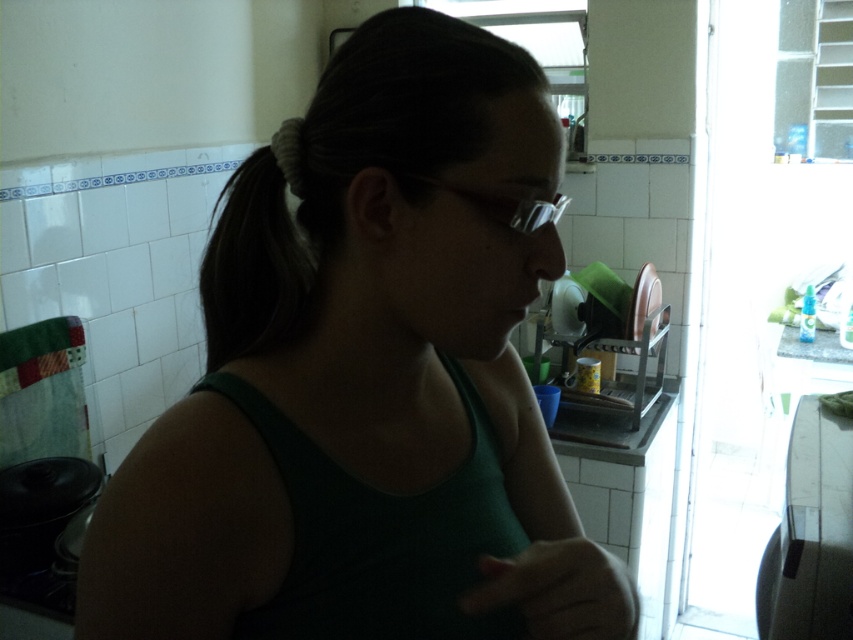
Question: Which object is the farthest from the dark brown hair at center?

Choices:
 (A) green fabric hand at lower center
 (B) green matte tank top at center

Answer: (A)

Question: Is green fabric hand at lower center wider than transparent plastic glasses at center?

Choices:
 (A) no
 (B) yes

Answer: (B)

Question: Which of the following is the closest to the observer?

Choices:
 (A) transparent plastic glasses at center
 (B) dark brown hair at center
 (C) green matte tank top at center

Answer: (C)

Question: In this image, where is green matte tank top at center located relative to green fabric hand at lower center?

Choices:
 (A) above
 (B) below

Answer: (A)

Question: From the image, what is the correct spatial relationship of dark brown hair at center in relation to transparent plastic glasses at center?

Choices:
 (A) below
 (B) above

Answer: (A)

Question: Which object is positioned closest to the green matte tank top at center?

Choices:
 (A) green fabric hand at lower center
 (B) transparent plastic glasses at center
 (C) dark brown hair at center

Answer: (C)